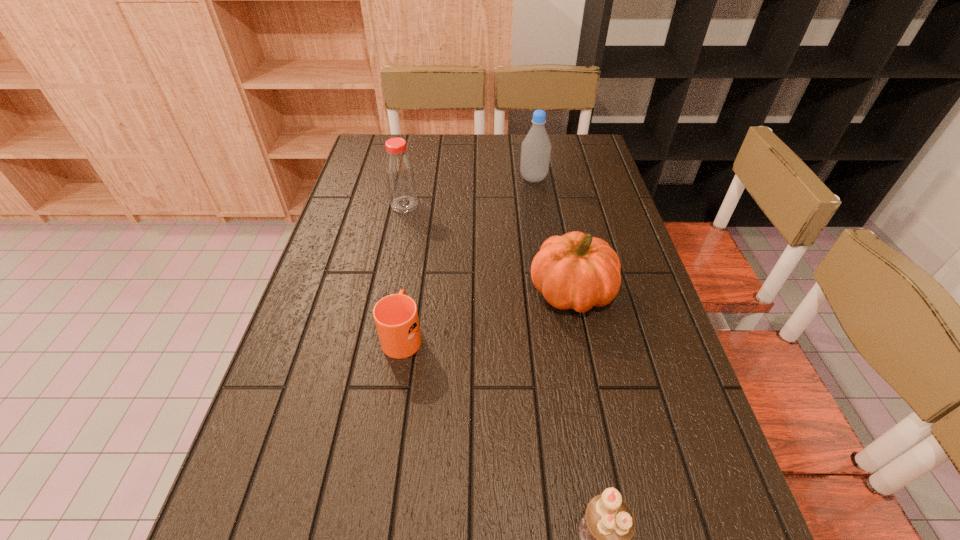
You are a GUI agent. You are given a task and a screenshot of the screen. Output one action in this format:
    pyautogui.click(x=<x>, y=<y>)
    Task: Click on the farther bottle
    
    Given the screenshot: What is the action you would take?
    pyautogui.click(x=536, y=147)

At what (x,y) coordinates should I click in order to perform the action: click on the right bottle. Please return your answer as a coordinate pair (x, y). Looking at the image, I should click on (536, 147).

Locate an element on the screen. This screenshot has width=960, height=540. the nearer bottle is located at coordinates (400, 177).

At what (x,y) coordinates should I click in order to perform the action: click on the fourth nearest object. Please return your answer as a coordinate pair (x, y). Image resolution: width=960 pixels, height=540 pixels. Looking at the image, I should click on (400, 177).

You are a GUI agent. You are given a task and a screenshot of the screen. Output one action in this format:
    pyautogui.click(x=<x>, y=<y>)
    Task: Click on the pumpkin
    The width and height of the screenshot is (960, 540).
    Given the screenshot: What is the action you would take?
    pyautogui.click(x=576, y=271)

In order to click on the shortest object in this screenshot , I will do `click(396, 318)`.

Identify the location of vacant area situated on the left of the right bottle. The height and width of the screenshot is (540, 960). (404, 179).

Locate an element on the screen. This screenshot has width=960, height=540. free spot located 0.050m on the right of the second farthest object is located at coordinates pyautogui.click(x=435, y=205).

Locate an element on the screen. vacant space located 0.320m on the left of the pumpkin is located at coordinates (399, 293).

Find the location of `free space located on the handle side of the shortest object`. free space located on the handle side of the shortest object is located at coordinates (415, 256).